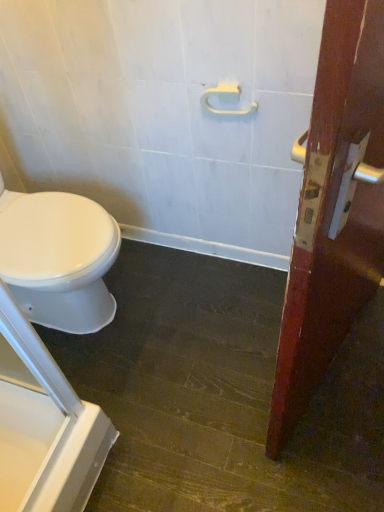
In order to click on wooden door at right in this screenshot , I will do point(334,209).

What do you see at coordinates (334, 209) in the screenshot? The width and height of the screenshot is (384, 512). I see `wooden door at right` at bounding box center [334, 209].

Locate an element on the screen. wooden door at right is located at coordinates (334, 209).